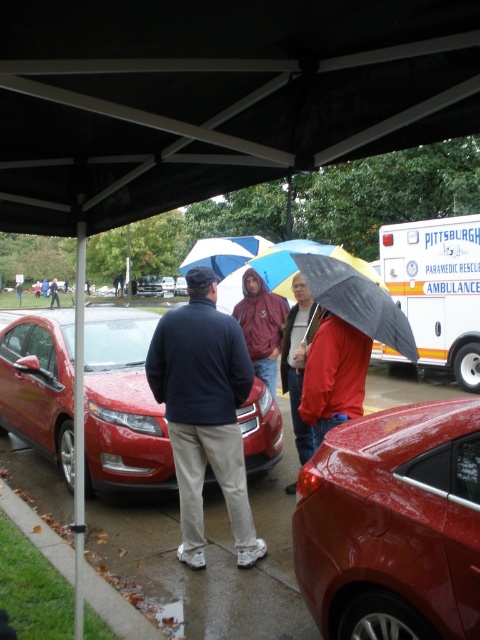
You are a pedestrian trying to cross the street safely. You see the white glossy ambulance at center and the dark blue jacket at center. Which object is closer to you based on their sizes?

The white glossy ambulance at center has a smaller size compared to dark blue jacket at center, so the dark blue jacket at center is closer to you because objects closer appear larger.